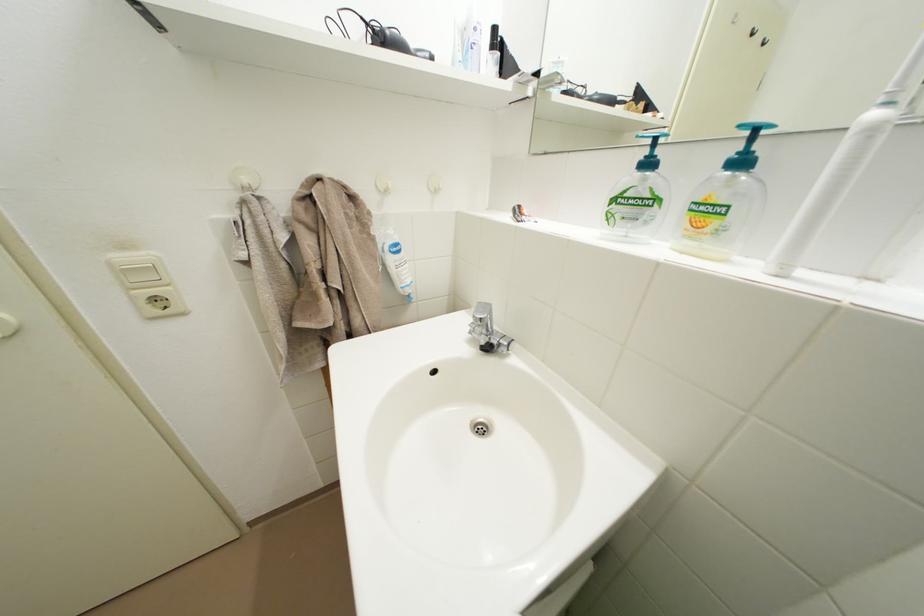
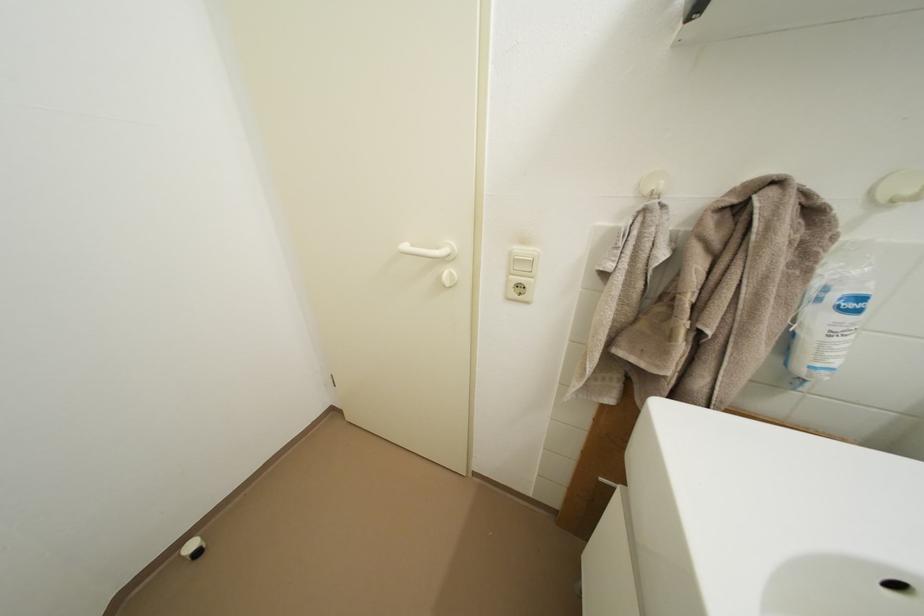
Question: The images are taken continuously from a first-person perspective. In which direction is your viewpoint rotating?

Choices:
 (A) Left
 (B) Right
 (C) Up
 (D) Down

Answer: (A)